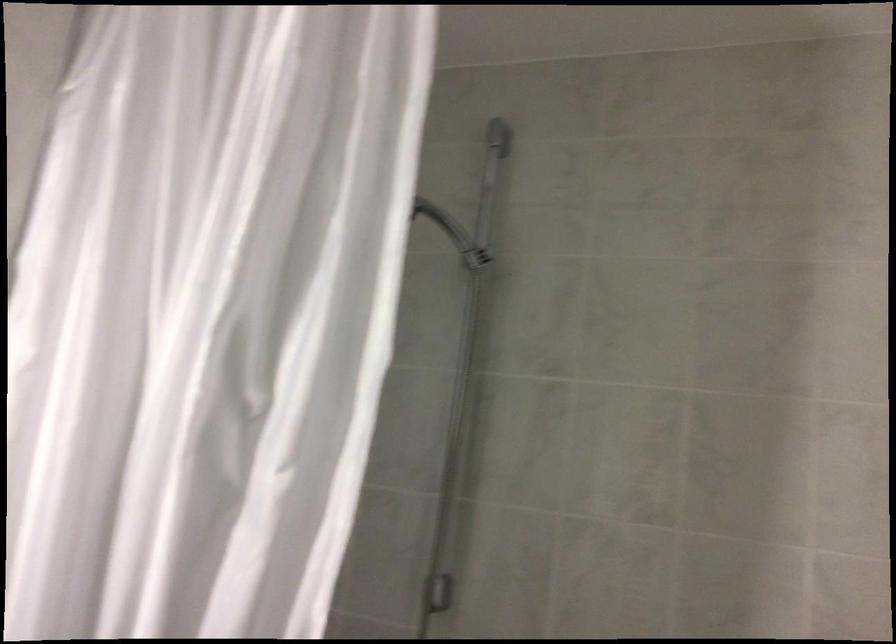
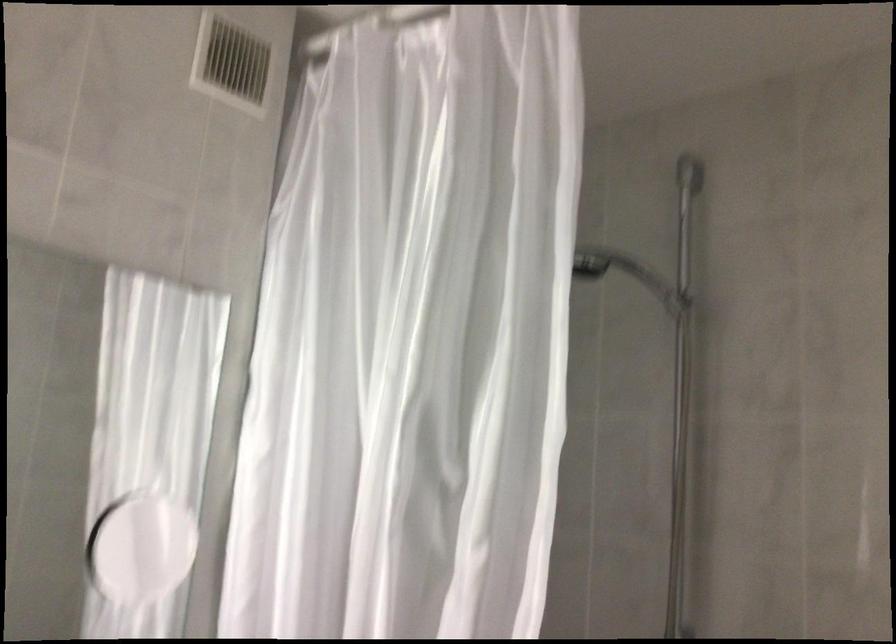
Question: The camera is either moving clockwise (left) or counter-clockwise (right) around the object. The first image is from the beginning of the video and the second image is from the end. Is the camera moving left or right when shooting the video?

Choices:
 (A) Left
 (B) Right

Answer: (B)